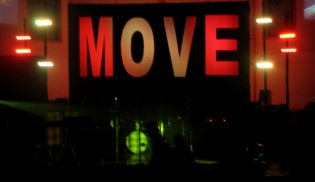
Locate an element on the screen. Image resolution: width=315 pixels, height=182 pixels. stage is located at coordinates (97, 161), (210, 164).